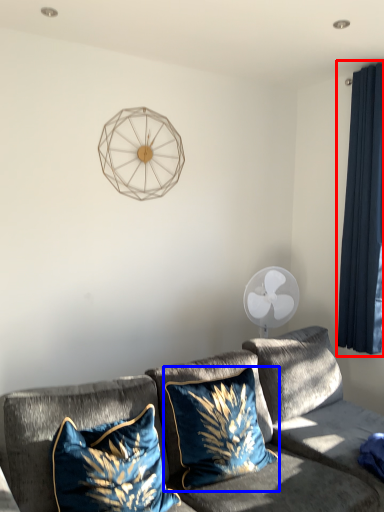
Question: Among these objects, which one is nearest to the camera, curtain (highlighted by a red box) or pillow (highlighted by a blue box)?

Choices:
 (A) curtain
 (B) pillow

Answer: (B)